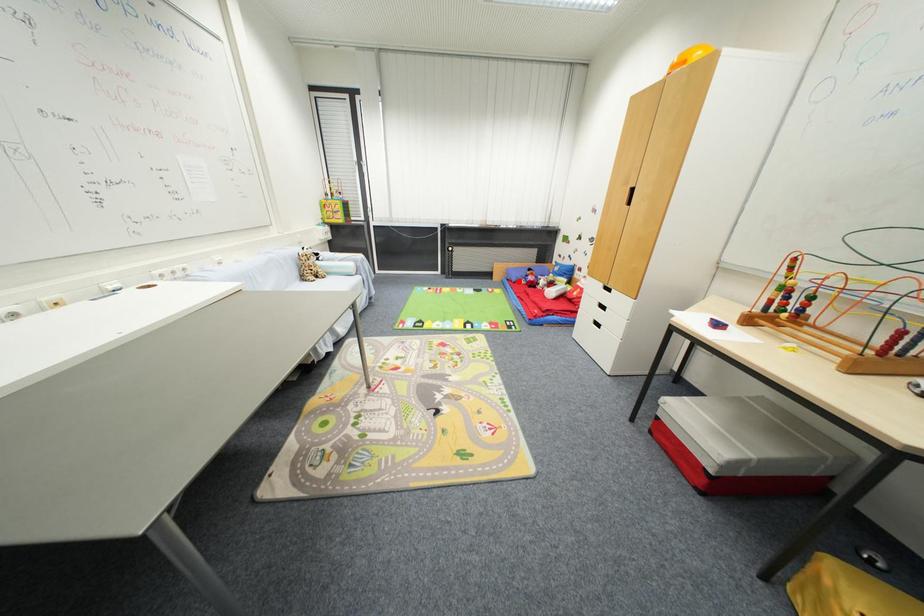
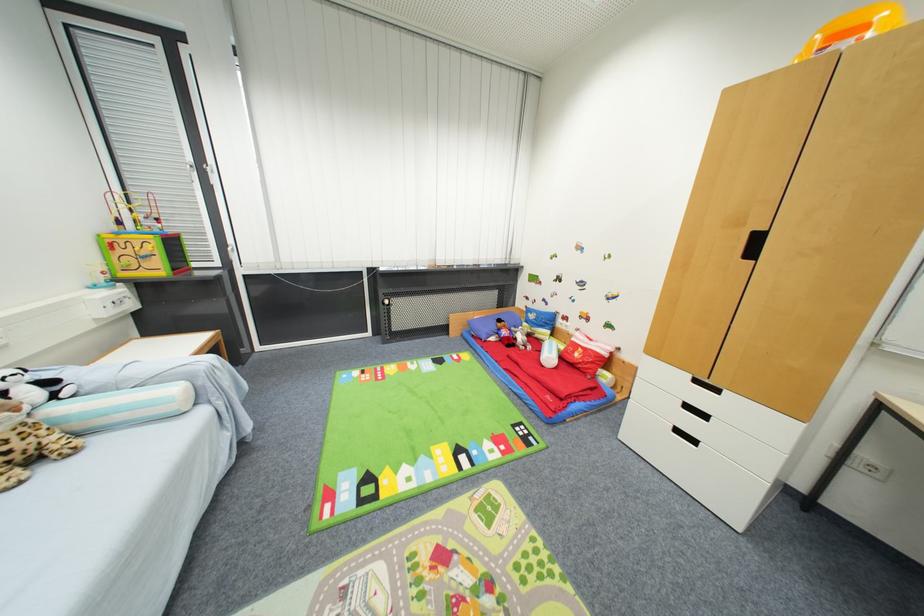
In the second image, find the point that corresponds to the highlighted location in the first image.

(488, 339)